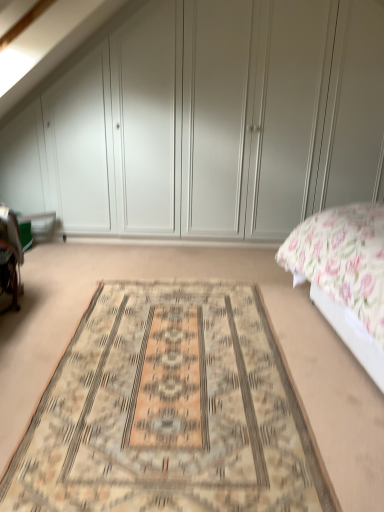
Question: From the image's perspective, is white matte wardrobe at upper center above or below beige woven rug at center?

Choices:
 (A) above
 (B) below

Answer: (A)

Question: Is white matte wardrobe at upper center bigger or smaller than beige woven rug at center?

Choices:
 (A) big
 (B) small

Answer: (A)

Question: Estimate the real-world distances between objects in this image. Which object is closer to the floral fabric bed at right?

Choices:
 (A) white matte wardrobe at upper center
 (B) beige woven rug at center

Answer: (B)

Question: Estimate the real-world distances between objects in this image. Which object is farther from the floral fabric bed at right?

Choices:
 (A) white matte wardrobe at upper center
 (B) beige woven rug at center

Answer: (A)